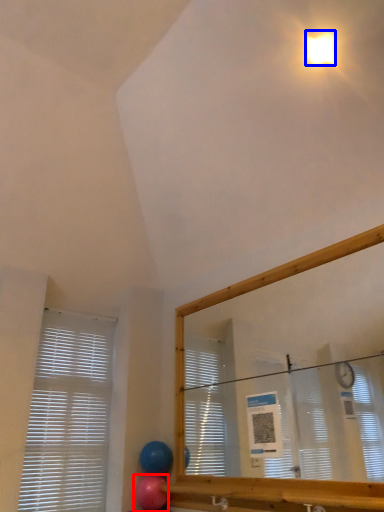
Question: Which object is closer to the camera taking this photo, balloon (highlighted by a red box) or light (highlighted by a blue box)?

Choices:
 (A) balloon
 (B) light

Answer: (B)